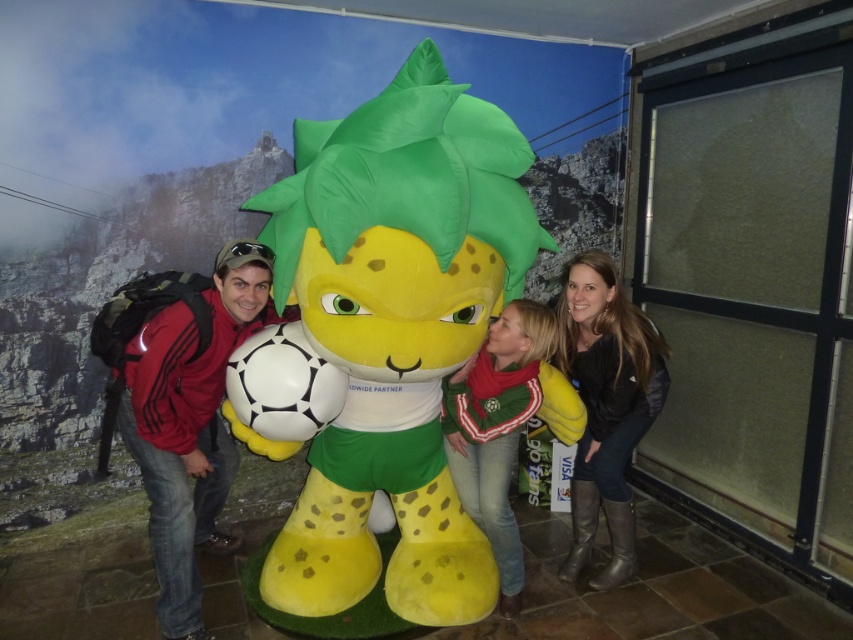
Is matte black jacket at lower right thinner than green jersey at center?

Incorrect, matte black jacket at lower right's width is not less than green jersey at center's.

Is matte black jacket at lower right to the right of green jersey at center from the viewer's perspective?

Indeed, matte black jacket at lower right is positioned on the right side of green jersey at center.

Is point (647, 384) closer to camera compared to point (508, 323)?

No, (647, 384) is behind (508, 323).

Find the location of a particular element. matte black jacket at lower right is located at coordinates (606, 404).